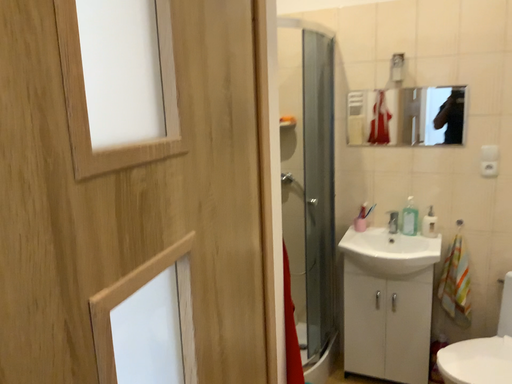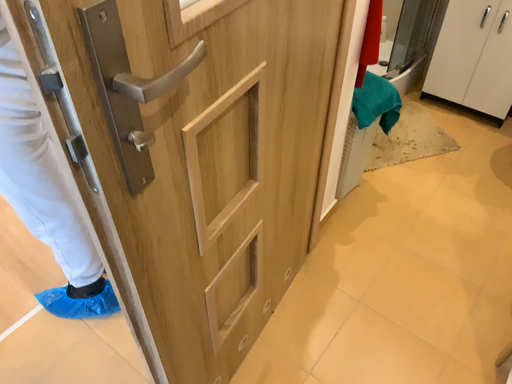
Question: How did the camera likely rotate when shooting the video?

Choices:
 (A) rotated left
 (B) rotated right

Answer: (A)